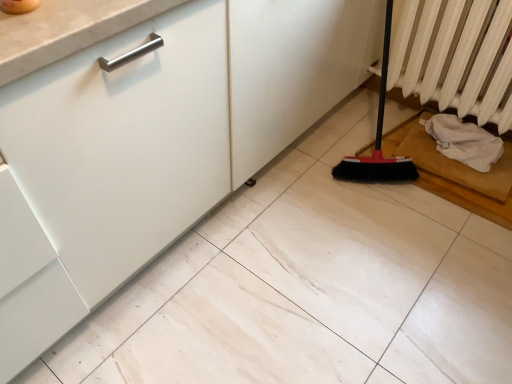
Find the location of a particular element. vacant space to the left of white fabric at lower right is located at coordinates (409, 149).